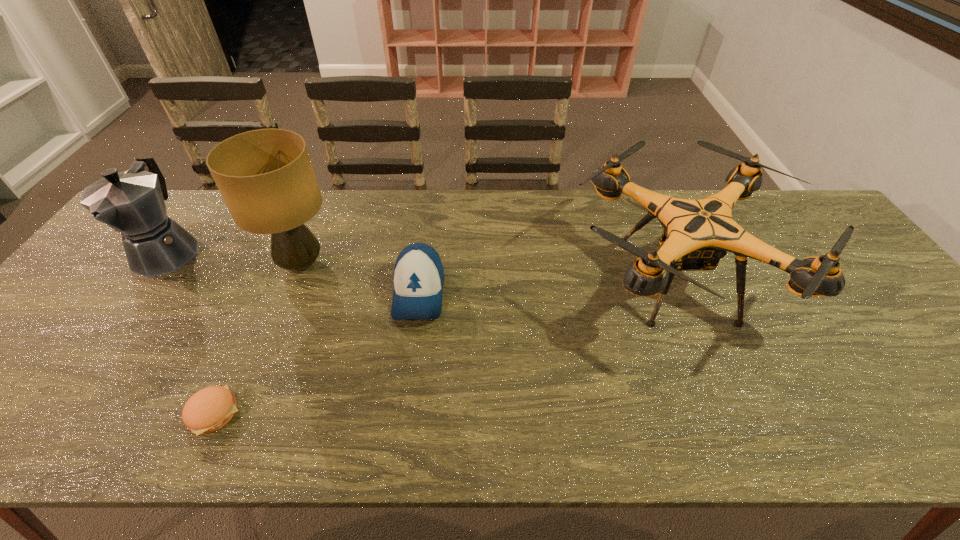
Find the location of `free spot between the fourth object from left to right and the patty`. free spot between the fourth object from left to right and the patty is located at coordinates (317, 353).

Identify the location of unoccupied position between the tallest object and the rightmost object. This screenshot has height=540, width=960. (489, 272).

Where is `vacant area that lies between the nearest object and the lampshade`? The width and height of the screenshot is (960, 540). vacant area that lies between the nearest object and the lampshade is located at coordinates (258, 339).

Identify which object is located as the third nearest to the lampshade. Please provide its 2D coordinates. Your answer should be formatted as a tuple, i.e. [(x, y)], where the tuple contains the x and y coordinates of a point satisfying the conditions above.

[(208, 410)]

Choose which object is the third nearest neighbor to the rightmost object. Please provide its 2D coordinates. Your answer should be formatted as a tuple, i.e. [(x, y)], where the tuple contains the x and y coordinates of a point satisfying the conditions above.

[(208, 410)]

The height and width of the screenshot is (540, 960). I want to click on vacant space that satisfies the following two spatial constraints: 1. at the spout of the patty; 2. on the right side of the coffeepot, so click(x=51, y=413).

Identify the location of blank area in the image that satisfies the following two spatial constraints: 1. at the spout of the shortest object; 2. on the right side of the leftmost object. (51, 413).

Locate an element on the screen. free space that satisfies the following two spatial constraints: 1. on the camera mount of the drone; 2. on the front-facing side of the baseball cap is located at coordinates (682, 293).

Where is `free space that satisfies the following two spatial constraints: 1. at the spout of the leftmost object; 2. on the right side of the patty`? free space that satisfies the following two spatial constraints: 1. at the spout of the leftmost object; 2. on the right side of the patty is located at coordinates (51, 413).

Identify the location of blank space that satisfies the following two spatial constraints: 1. on the camera mount of the rightmost object; 2. on the front-facing side of the baseball cap. (682, 293).